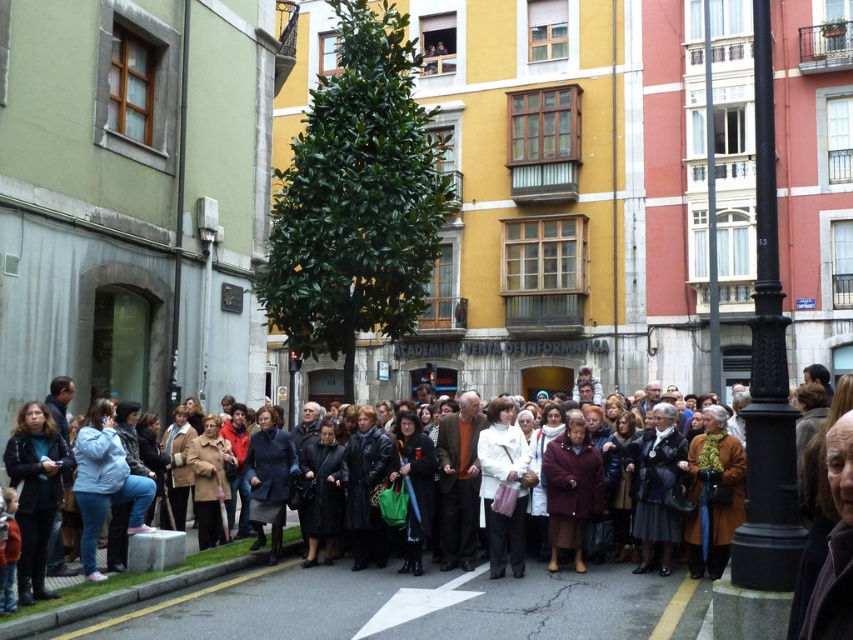
You are a photographer trying to capture a photo of the maroon wool coat at center without including the dark brown leather coat at center in the frame. Given their positions, is this possible?

The dark brown leather coat at center is located above the maroon wool coat at center, so if you position your camera to focus on the maroon wool coat at center and avoid looking upwards, you can exclude the dark brown leather coat at center from the frame.

You are a photographer trying to capture a photo of the crowd. You notice two coats in the center of the image, a dark brown leather coat at center and a white matte coat at center. Which coat should you focus on if you want to include the black lamppost in your shot?

The dark brown leather coat at center is to the left of the white matte coat at center. Since the black lamppost is on the right side of the frame, focusing on the dark brown leather coat at center would position it closer to the lamppost in the shot.

You are a tailor observing two coats in the crowd at the street corner. The maroon wool coat at center and the dark blue wool coat at center. Which coat would you estimate to be smaller in size?

The maroon wool coat at center is smaller than the dark blue wool coat at center, so the maroon one is the smaller one.